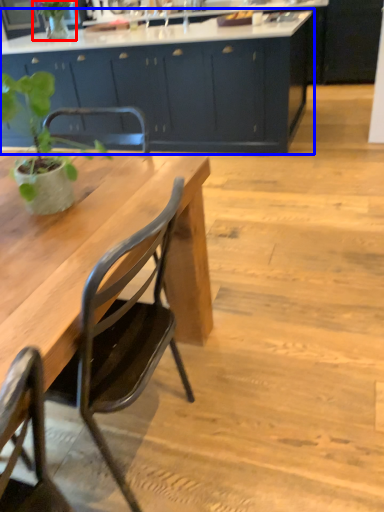
Question: Which point is further to the camera, plant (highlighted by a red box) or cabinetry (highlighted by a blue box)?

Choices:
 (A) plant
 (B) cabinetry

Answer: (A)